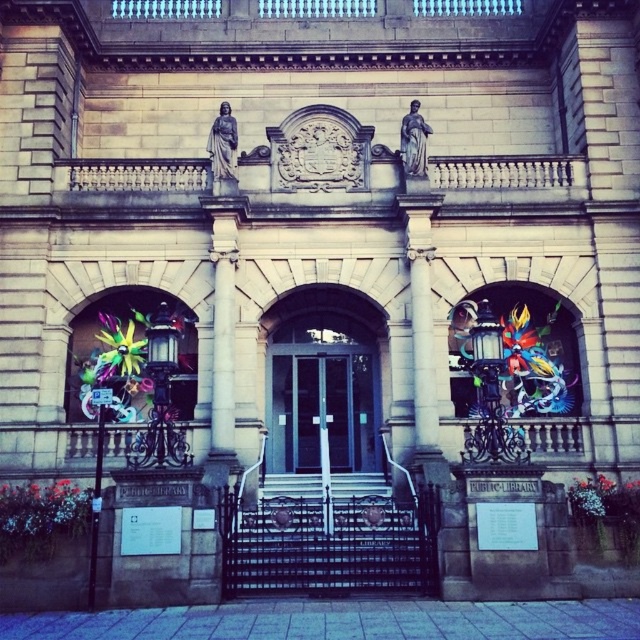
Question: Among these objects, which one is nearest to the camera?

Choices:
 (A) white stone stairs at center
 (B) matte glass doors at center
 (C) white marble pillar at center

Answer: (C)

Question: Estimate the real-world distances between objects in this image. Which object is closer to the white marble pillar at center?

Choices:
 (A) matte glass doors at center
 (B) white stone stairs at center

Answer: (B)

Question: Estimate the real-world distances between objects in this image. Which object is closer to the white stone stairs at center?

Choices:
 (A) matte glass doors at center
 (B) white marble pillar at center

Answer: (A)

Question: Does white marble pillar at center appear on the left side of white stone stairs at center?

Choices:
 (A) no
 (B) yes

Answer: (B)

Question: Does matte glass doors at center have a lesser width compared to white stone stairs at center?

Choices:
 (A) yes
 (B) no

Answer: (A)

Question: Does white marble pillar at center have a smaller size compared to white stone stairs at center?

Choices:
 (A) yes
 (B) no

Answer: (B)